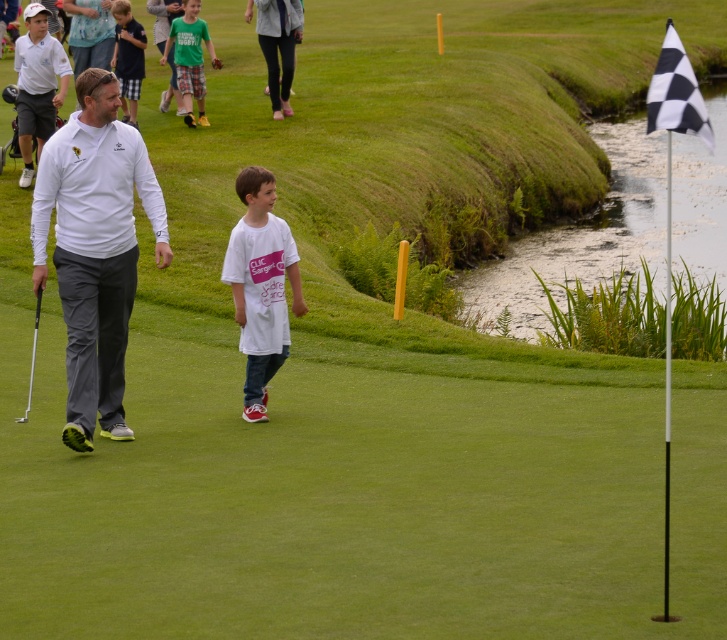
Between point (87, 438) and point (36, 339), which one is positioned in front?

Positioned in front is point (36, 339).

Is white matte golf club at center further to the viewer compared to metallic silver golf club at left?

Yes, white matte golf club at center is further from the viewer.

Is point (88, 228) closer to camera compared to point (36, 324)?

That is False.

This screenshot has height=640, width=727. In order to click on white matte golf club at center in this screenshot , I will do `click(95, 248)`.

Who is more distant from viewer, (x=40, y=268) or (x=286, y=260)?

The point (x=286, y=260) is behind.

Does white matte golf club at center appear over white matte t-shirt at center?

Yes, white matte golf club at center is above white matte t-shirt at center.

The width and height of the screenshot is (727, 640). What do you see at coordinates (95, 248) in the screenshot?
I see `white matte golf club at center` at bounding box center [95, 248].

You are a GUI agent. You are given a task and a screenshot of the screen. Output one action in this format:
    pyautogui.click(x=<x>, y=<y>)
    Task: Click on the white matte golf club at center
    
    Given the screenshot: What is the action you would take?
    pyautogui.click(x=95, y=248)

Does point (182, 38) come farther from viewer compared to point (36, 296)?

Yes, point (182, 38) is farther from viewer.

Describe the element at coordinates (190, 58) in the screenshot. I see `green plaid shorts at upper center` at that location.

Is point (192, 44) positioned in front of point (28, 412)?

No, (192, 44) is further to viewer.

Locate an element on the screen. The height and width of the screenshot is (640, 727). green plaid shorts at upper center is located at coordinates (190, 58).